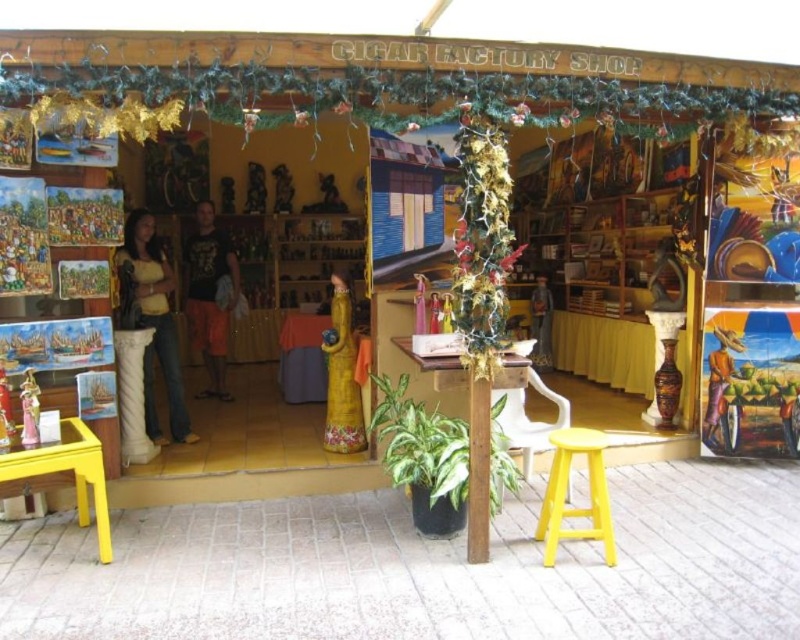
Question: Does yellow plastic stool at lower center have a lesser width compared to wooden statue at center?

Choices:
 (A) no
 (B) yes

Answer: (A)

Question: Where is jeans at left located in relation to yellow plastic stool at lower center in the image?

Choices:
 (A) right
 (B) left

Answer: (B)

Question: Which object is farther from the camera taking this photo?

Choices:
 (A) orange cotton shorts at center
 (B) wooden statue at center
 (C) yellow plastic stool at lower center
 (D) jeans at left

Answer: (A)

Question: Which point is farther from the camera taking this photo?

Choices:
 (A) (202, 228)
 (B) (132, 321)
 (C) (342, 429)

Answer: (A)

Question: Does yellow plastic stool at lower center have a lesser width compared to wooden statue at center?

Choices:
 (A) yes
 (B) no

Answer: (B)

Question: Which object is farther from the camera taking this photo?

Choices:
 (A) yellow plastic stool at lower center
 (B) jeans at left
 (C) orange cotton shorts at center

Answer: (C)